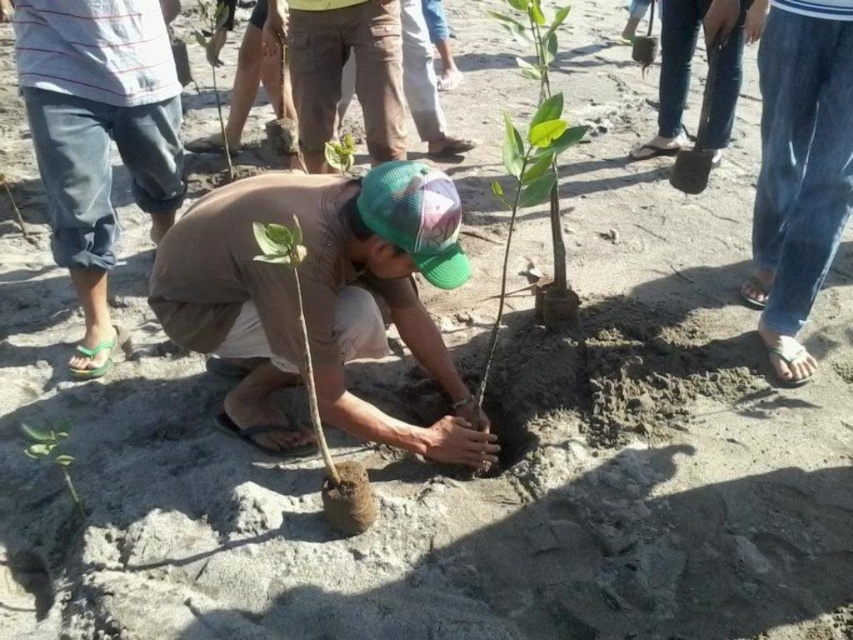
Question: Which point is closer to the camera?

Choices:
 (A) green matte plant at lower left
 (B) denim jeans at lower right
 (C) jeans at center

Answer: (A)

Question: Does brown cotton shirt at center appear under green matte plant at lower left?

Choices:
 (A) yes
 (B) no

Answer: (B)

Question: Which is nearer to the denim shorts at left?

Choices:
 (A) jeans at center
 (B) green matte plant at center

Answer: (B)

Question: Is denim jeans at lower right thinner than metallic silver shovel at upper right?

Choices:
 (A) no
 (B) yes

Answer: (A)

Question: Can you confirm if denim shorts at left is positioned to the left of green matte plant at center?

Choices:
 (A) no
 (B) yes

Answer: (B)

Question: Which of the following is the closest to the observer?

Choices:
 (A) (347, 166)
 (B) (267, 422)
 (C) (537, 42)

Answer: (C)